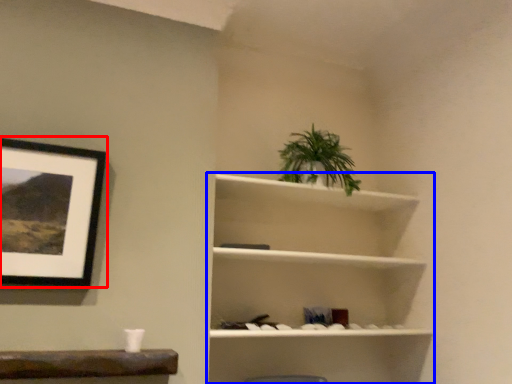
Question: Which object is further to the camera taking this photo, picture frame (highlighted by a red box) or shelf (highlighted by a blue box)?

Choices:
 (A) picture frame
 (B) shelf

Answer: (B)